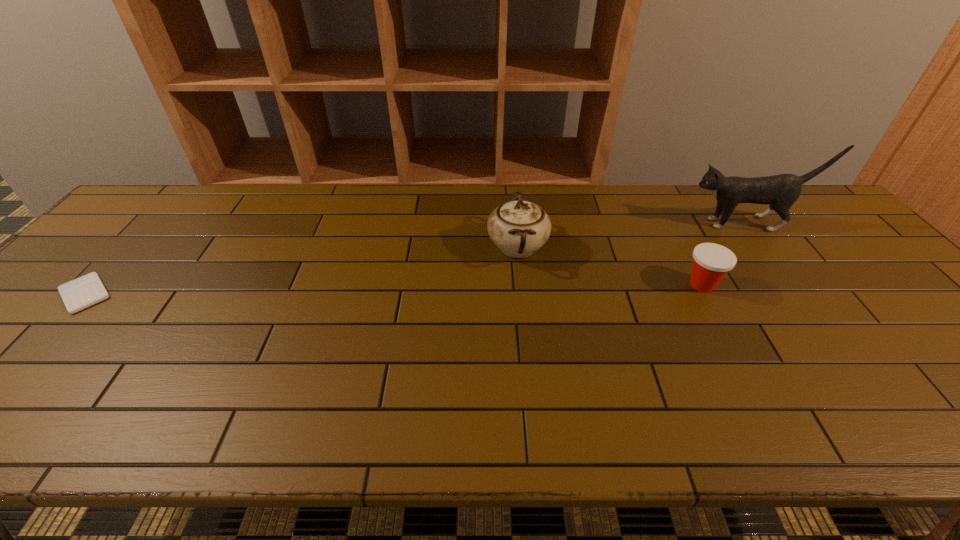
This screenshot has height=540, width=960. Find the location of `cat`. cat is located at coordinates (781, 191).

At what (x,y) coordinates should I click in order to perform the action: click on the second object from left to right. Please return your answer as a coordinate pair (x, y). The width and height of the screenshot is (960, 540). Looking at the image, I should click on (518, 227).

The height and width of the screenshot is (540, 960). Find the location of `chinaware`. chinaware is located at coordinates (518, 227).

Locate an element on the screen. the second shortest object is located at coordinates 711,262.

Where is `calculator`? calculator is located at coordinates (78, 294).

The image size is (960, 540). I want to click on the shortest object, so click(78, 294).

Locate an element on the screen. vacant space located 0.400m at the face of the tallest object is located at coordinates (553, 224).

Locate an element on the screen. vacant space located 0.370m at the face of the tallest object is located at coordinates (563, 224).

This screenshot has width=960, height=540. I want to click on vacant space located 0.350m at the face of the tallest object, so click(x=569, y=224).

At what (x,y) coordinates should I click in order to perform the action: click on free space located 0.190m on the back of the second object from left to right. Please return your answer as a coordinate pair (x, y). This screenshot has width=960, height=540. Looking at the image, I should click on (512, 190).